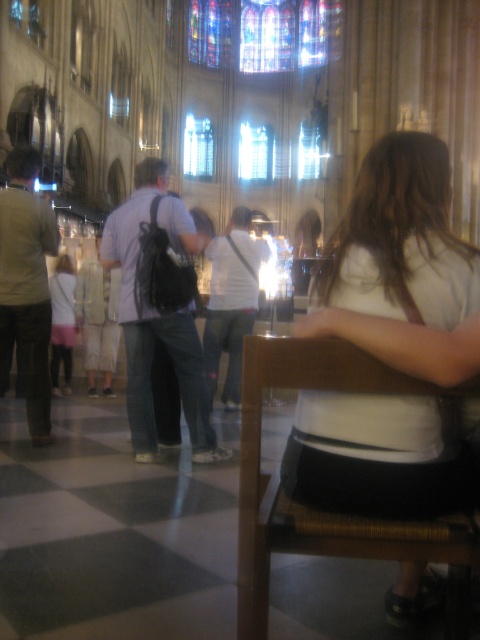
Between brown woven chair at center and clear glass window at center, which one has less height?

brown woven chair at center is shorter.

Who is higher up, brown woven chair at center or clear glass window at center?

clear glass window at center

Locate an element on the screen. brown woven chair at center is located at coordinates point(317,509).

From the picture: Is white cotton shirt at lower left positioned at the back of clear glass window at center?

That is False.

Is white cotton shirt at lower left to the right of clear glass window at center from the viewer's perspective?

In fact, white cotton shirt at lower left is to the left of clear glass window at center.

Is point (60, 273) less distant than point (193, 147)?

Yes, it is in front of point (193, 147).

The height and width of the screenshot is (640, 480). I want to click on white cotton shirt at lower left, so click(x=61, y=321).

Which of these two, brown woven chair at center or white cotton shirt at lower left, stands taller?

Standing taller between the two is white cotton shirt at lower left.

Is brown woven chair at center below white cotton shirt at lower left?

Correct, brown woven chair at center is located below white cotton shirt at lower left.

Between point (470, 525) and point (72, 330), which one is positioned behind?

The point (72, 330) is more distant.

Where is `brown woven chair at center`? The image size is (480, 640). brown woven chair at center is located at coordinates (317, 509).